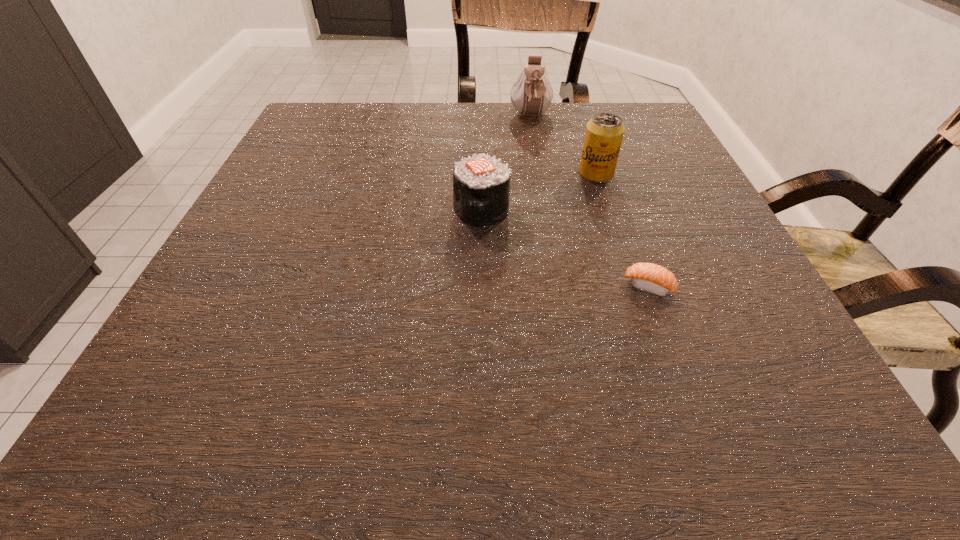
This screenshot has width=960, height=540. Find the location of `free point between the farther sushi and the pouch`. free point between the farther sushi and the pouch is located at coordinates (506, 163).

The image size is (960, 540). Identify the location of unoccupied position between the pouch and the left sushi. (506, 163).

Identify the location of free space between the second farthest object and the pouch. This screenshot has width=960, height=540. (x=564, y=145).

The image size is (960, 540). I want to click on blank region between the nearest object and the pouch, so click(x=589, y=201).

Image resolution: width=960 pixels, height=540 pixels. I want to click on free spot between the pouch and the second farthest object, so 564,145.

The image size is (960, 540). In order to click on unoccupied area between the pouch and the nearer sushi in this screenshot , I will do `click(589, 201)`.

Where is `empty location between the third nearest object and the second object from left to right`? This screenshot has height=540, width=960. empty location between the third nearest object and the second object from left to right is located at coordinates (564, 145).

Find the location of a particular element. The width and height of the screenshot is (960, 540). empty location between the beer can and the third object from right to left is located at coordinates (564, 145).

The width and height of the screenshot is (960, 540). Identify the location of vacant area between the nearest object and the third nearest object. (622, 230).

The width and height of the screenshot is (960, 540). What are the coordinates of `free point between the nearest object and the second farthest object` in the screenshot? It's located at (622, 230).